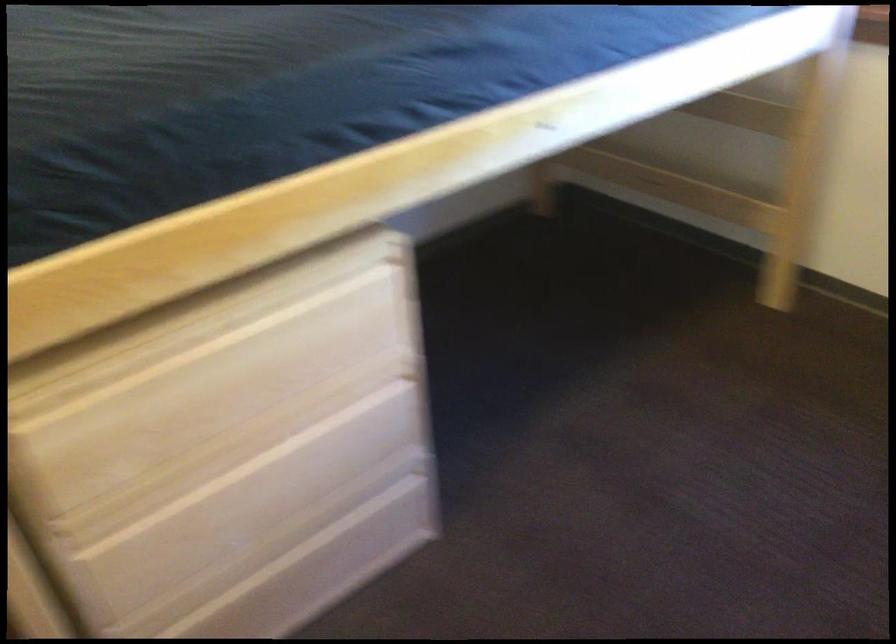
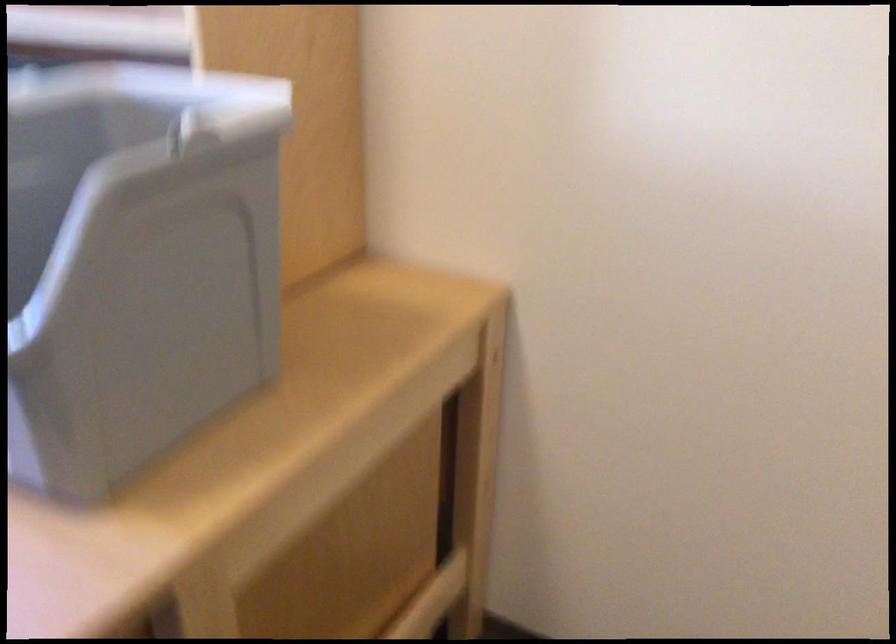
The first image is from the beginning of the video and the second image is from the end. How did the camera likely rotate when shooting the video?

The rotation direction of the camera is right-down.